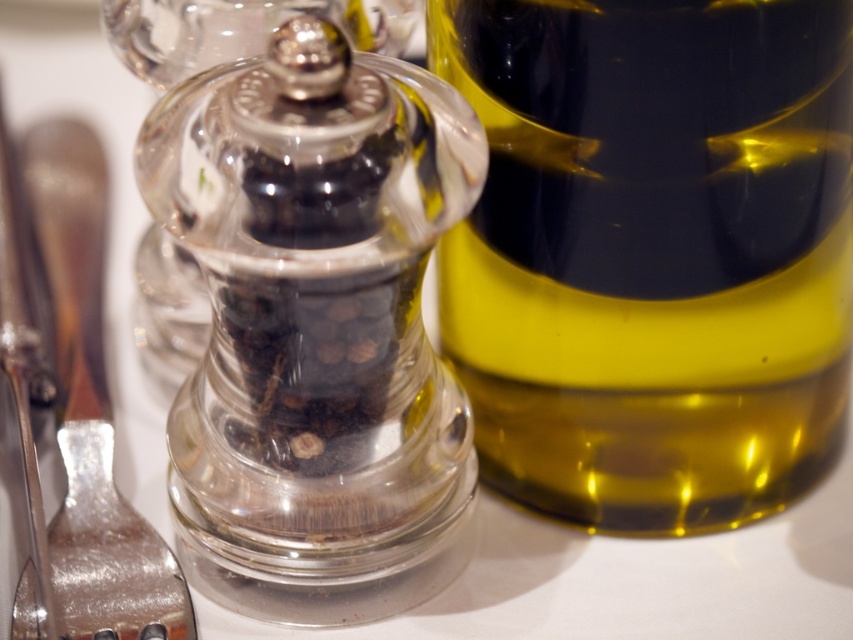
Question: Which object is closer to the camera taking this photo?

Choices:
 (A) transparent glass pepper grinder at center
 (B) transparent glass pepper mill at center
 (C) yellow translucent bottle at right

Answer: (B)

Question: Can you confirm if shiny metallic fork at left is wider than transparent glass pepper grinder at center?

Choices:
 (A) yes
 (B) no

Answer: (A)

Question: Can you confirm if yellow translucent bottle at right is bigger than transparent glass pepper grinder at center?

Choices:
 (A) yes
 (B) no

Answer: (A)

Question: Among these objects, which one is nearest to the camera?

Choices:
 (A) transparent glass pepper grinder at center
 (B) transparent glass pepper mill at center
 (C) yellow translucent bottle at right
 (D) shiny metallic fork at left

Answer: (B)

Question: Is transparent glass pepper mill at center thinner than transparent glass pepper grinder at center?

Choices:
 (A) yes
 (B) no

Answer: (A)

Question: Among these points, which one is farthest from the camera?

Choices:
 (A) (186, 38)
 (B) (503, 392)
 (C) (93, 243)
 (D) (430, 528)

Answer: (C)